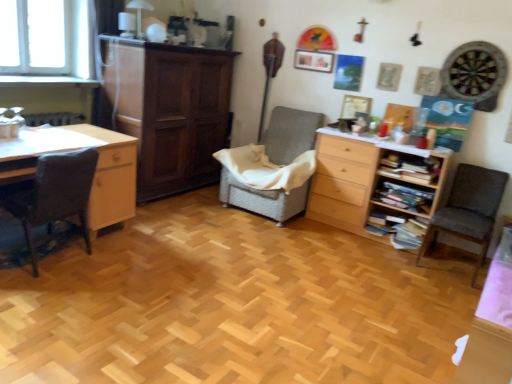
Question: Is woven fabric chair at center, arranged as the 2th chair when viewed from the left, spatially inside dark gray fabric chair at right, which appears as the third chair when viewed from the left, or outside of it?

Choices:
 (A) outside
 (B) inside

Answer: (A)

Question: Looking at the image, does woven fabric chair at center, arranged as the 2th chair when viewed from the left, seem bigger or smaller compared to dark gray fabric chair at right, the first chair from the right?

Choices:
 (A) small
 (B) big

Answer: (B)

Question: Estimate the real-world distances between objects in this image. Which object is closer to the dark gray fabric chair at left, the first chair from the left?

Choices:
 (A) dark gray fabric chair at right, the first chair from the right
 (B) wooden bookshelf at right, which is the 2th shelf in top-to-bottom order
 (C) woven fabric chair at center, arranged as the 2th chair when viewed from the left
 (D) wooden bookshelf at right, which appears as the 2th shelf when ordered from the bottom
 (E) light wood desk at left

Answer: (E)

Question: Which object is the closest to the light wood desk at left?

Choices:
 (A) dark gray fabric chair at right, which appears as the third chair when viewed from the left
 (B) woven fabric chair at center, arranged as the 2th chair when viewed from the left
 (C) light wood chest of drawers at center right
 (D) dark brown wood cabinet at center
 (E) wooden bookshelf at right, acting as the 1th shelf starting from the top

Answer: (D)